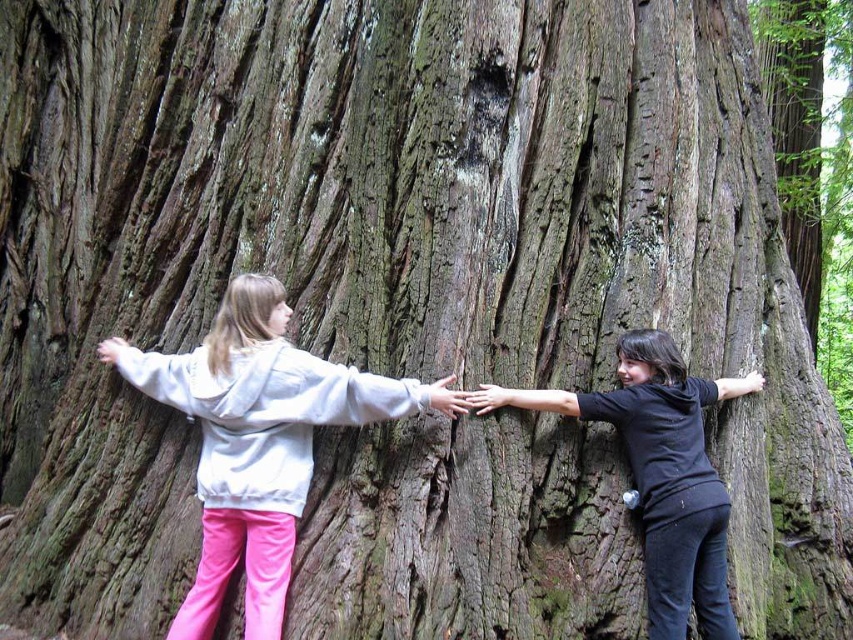
You are a photographer trying to capture both the light gray hoodie at center and the black matte shirt at right in a single frame. Since the tree trunk is massive, you need to adjust your position. Which person should you move closer to the camera to ensure both are fully visible in the photo?

The light gray hoodie at center is already closer to the viewer than the black matte shirt at right. To ensure both are fully visible, you should move the black matte shirt at right closer to the camera so it aligns with the light gray hoodie at center in terms of distance from the camera.

You are a photographer planning to take a picture of the light gray hoodie at center and the smooth brown hand at center. Based on their positions, which object should you focus on first to ensure both are in sharp focus?

The light gray hoodie at center is positioned under the smooth brown hand at center. To ensure both are in sharp focus, you should focus on the smooth brown hand at center first since it is closer to the camera.

You are a photographer trying to capture a wide shot of the black matte shirt at right and the smooth brown hand at center. Based on their relative sizes, which object would appear larger in the photo?

The black matte shirt at right would appear larger in the photo since its width surpasses that of the smooth brown hand at center.